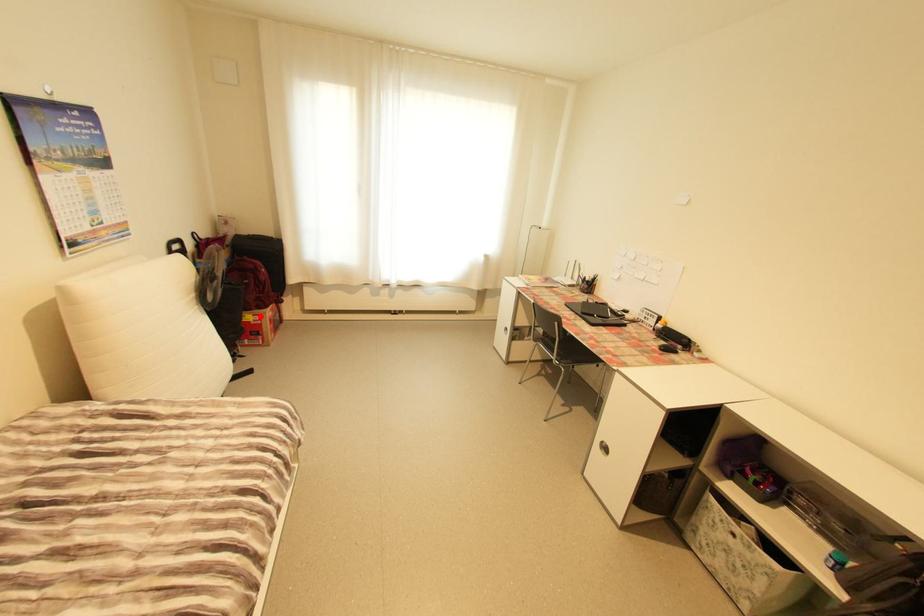
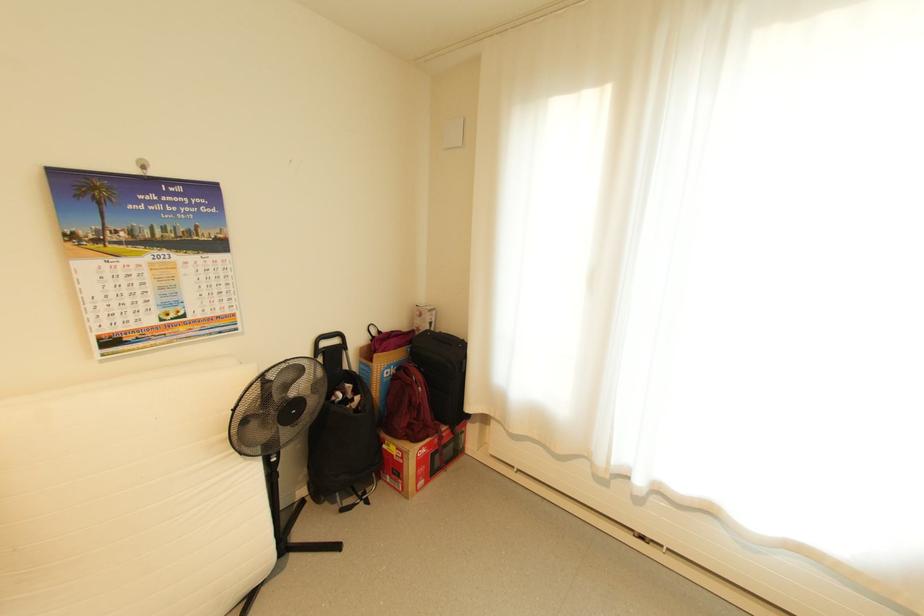
Question: I am providing you with two images of the same scene from different viewpoints. Given a red point in image1, look at the same physical point in image2. Is it:

Choices:
 (A) Closer to the viewpoint
 (B) Farther from the viewpoint

Answer: (B)